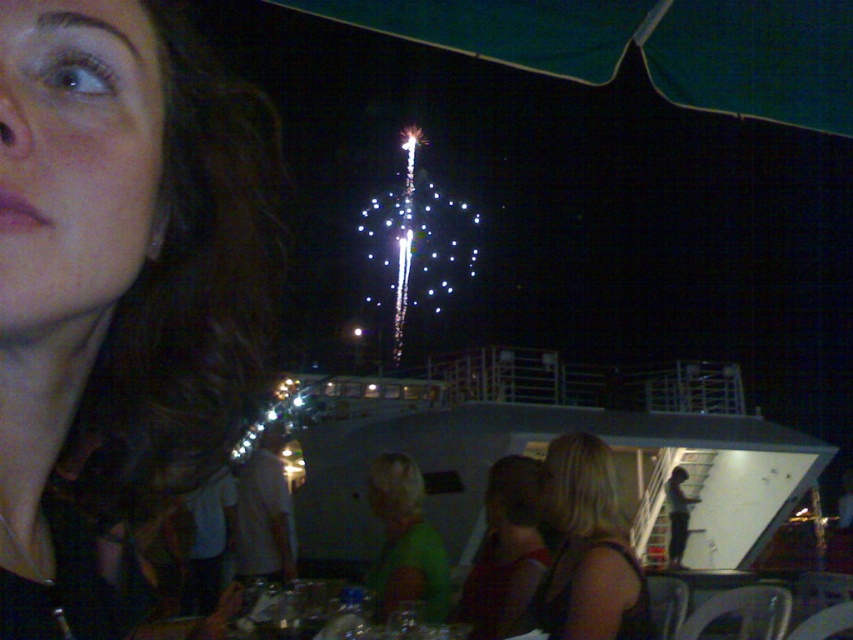
You are at a party and want to find the person with the blonde hair at lower right. Which direction should you look relative to the person with the matte black hair at upper left?

The blonde hair at lower right is to the right of the matte black hair at upper left, so you should look to the right from the matte black hair at upper left to find the blonde hair at lower right.

You are a photographer trying to capture the perfect shot of the matte black hair at upper left. The camera has a zoom feature that can focus on coordinates between 0 and 1. You want to center your shot on the hair. What coordinates should you aim for?

The coordinates for the matte black hair at upper left are at point (119,275), so you should aim for those coordinates to center the shot.